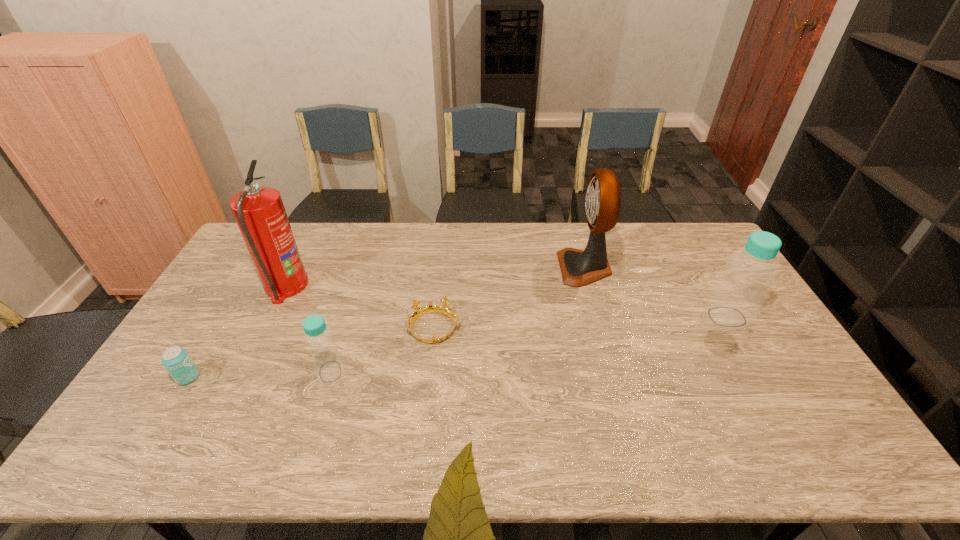
To ensure equal spacing by inserting another bottle among them, please point out a vacant spot for this new bottle. Please provide its 2D coordinates. Your answer should be formatted as a tuple, i.e. [(x, y)], where the tuple contains the x and y coordinates of a point satisfying the conditions above.

[(540, 342)]